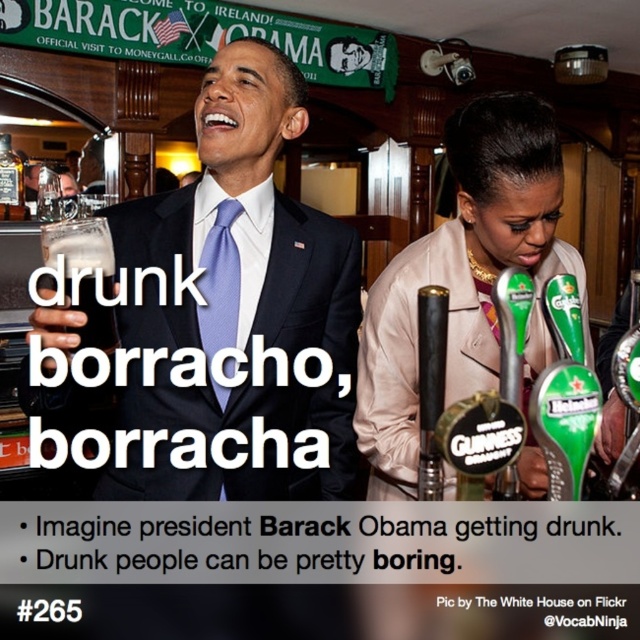
In the scene of the pub with Barack Obama themed decor, where exactly is the translucent glass beer at upper left located in terms of coordinates?

The translucent glass beer at upper left is located at coordinates point (84, 275).

You are a photographer setting up a photo shoot in the pub scene described. You need to place a small prop between the light beige fabric jacket at center and the matte blue tie at center. Based on their sizes, which object should the prop be placed closer to?

The light beige fabric jacket at center is wider than the matte blue tie at center, so the prop should be placed closer to the light beige fabric jacket at center to maintain balance in the composition.